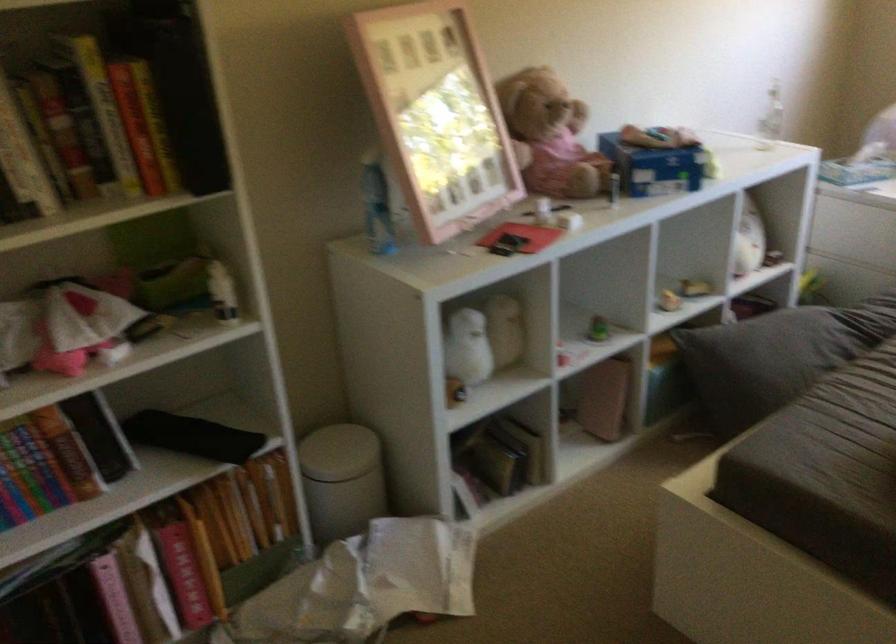
Where is `grey throw pillow`? The width and height of the screenshot is (896, 644). grey throw pillow is located at coordinates (776, 357).